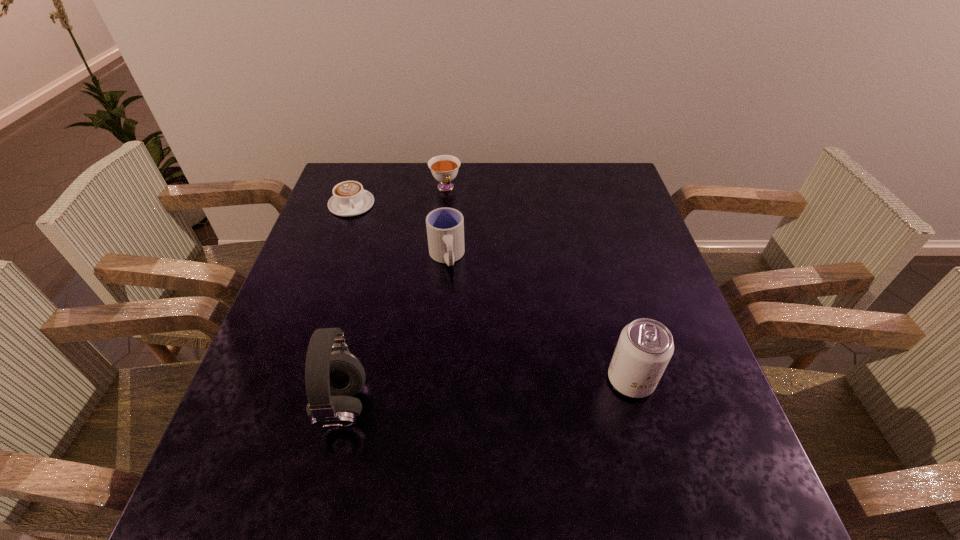
Identify which object is located as the third nearest to the headset. Please provide its 2D coordinates. Your answer should be formatted as a tuple, i.e. [(x, y)], where the tuple contains the x and y coordinates of a point satisfying the conditions above.

[(349, 198)]

What are the coordinates of `vacant space that satisfies the following two spatial constraints: 1. on the front side of the tallest object; 2. on the ear cups of the cappuccino` in the screenshot? It's located at (281, 406).

Identify the location of blank area in the image that satisfies the following two spatial constraints: 1. on the back side of the leftmost object; 2. on the right side of the teacup. Image resolution: width=960 pixels, height=540 pixels. tap(357, 188).